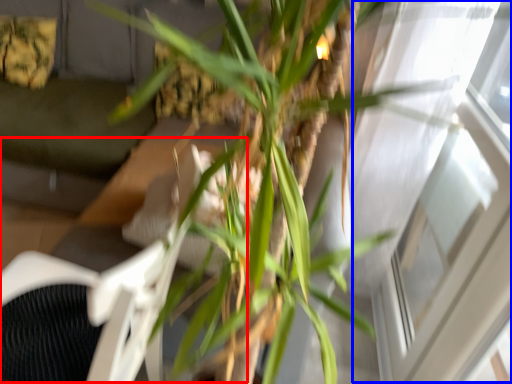
Question: Which object appears closest to the camera in this image, swivel chair (highlighted by a red box) or window (highlighted by a blue box)?

Choices:
 (A) swivel chair
 (B) window

Answer: (A)